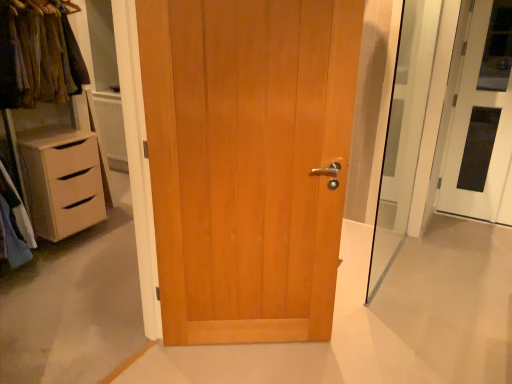
Find the location of a particular element. free spot to the right of transparent glass screen door at right is located at coordinates (457, 266).